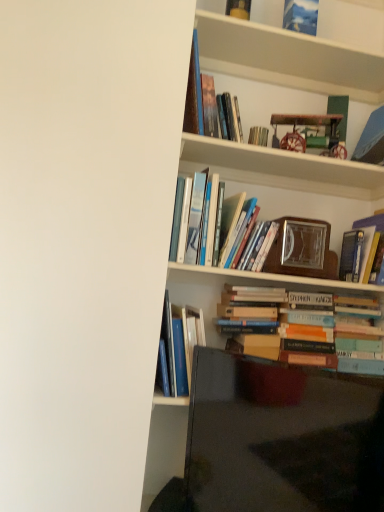
Question: Is matte yellow book at upper center, arranged as the first book when viewed from the top, taller or shorter than hardcover books at center, which is counted as the fourth book, starting from the top?

Choices:
 (A) tall
 (B) short

Answer: (B)

Question: Relative to hardcover books at center, which is the fifth book from bottom to top, is matte yellow book at upper center, arranged as the first book when viewed from the top, in front or behind?

Choices:
 (A) front
 (B) behind

Answer: (B)

Question: Estimate the real-world distances between objects in this image. Which object is farther from the metallic silver book at upper center, the sixth book in the bottom-to-top sequence?

Choices:
 (A) hardcover book at upper right, which appears as the sixth book when viewed from the top
 (B) hardcover books at center, which is counted as the fourth book, starting from the top
 (C) hardcover books at center, which is the second book in bottom-to-top order
 (D) hardcover books at center, positioned as the fourth book in bottom-to-top order
 (E) wooden bookshelf at upper center

Answer: (C)

Question: Estimate the real-world distances between objects in this image. Which object is closer to the hardcover books at center, which is the fifth book from bottom to top?

Choices:
 (A) wooden clock at upper center
 (B) wooden picture frame at center-right
 (C) wooden bookshelf at upper center
 (D) matte yellow book at upper center, marked as the eighth book in a bottom-to-top arrangement
 (E) matte black tv at lower right

Answer: (B)